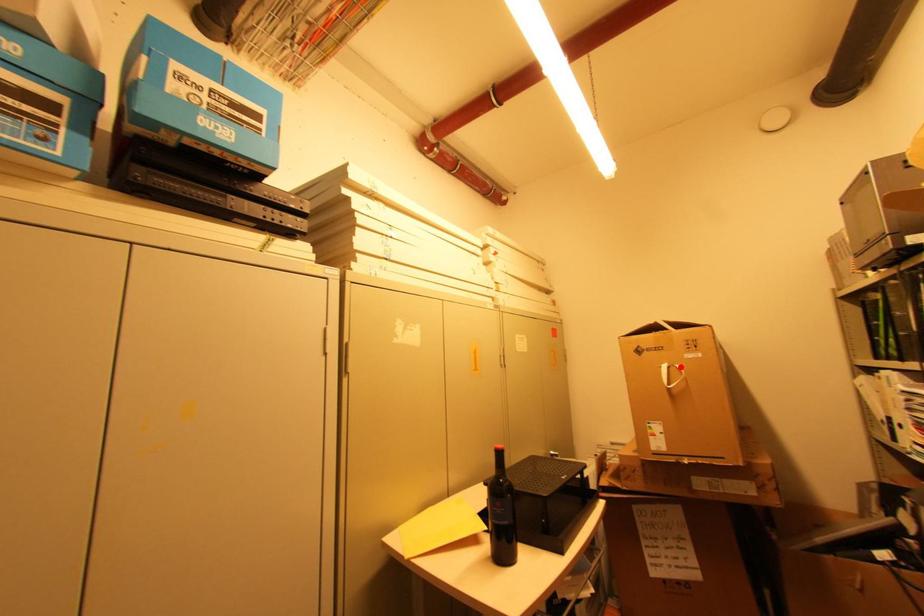
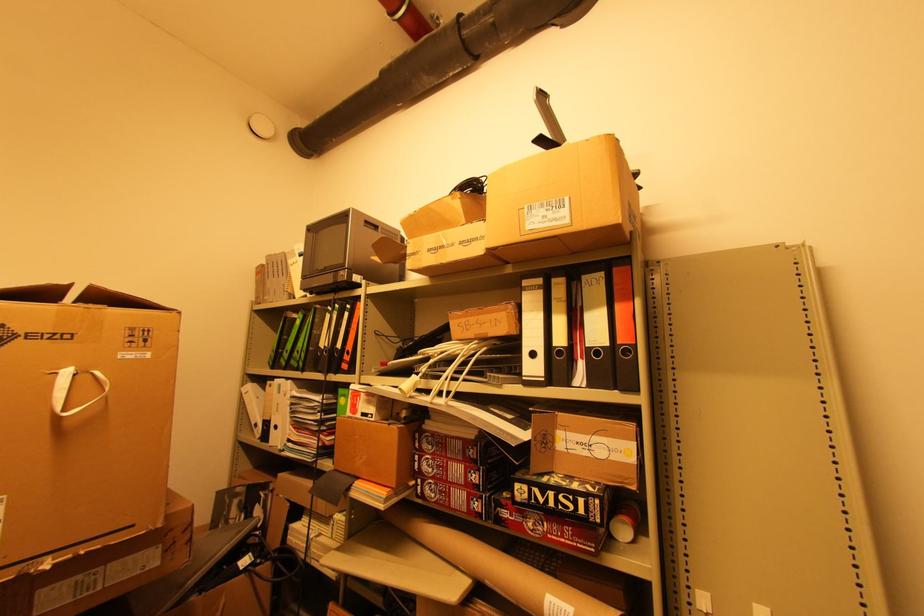
Where in the second image is the point corresponding to the highlighted location from the first image?

(101, 373)